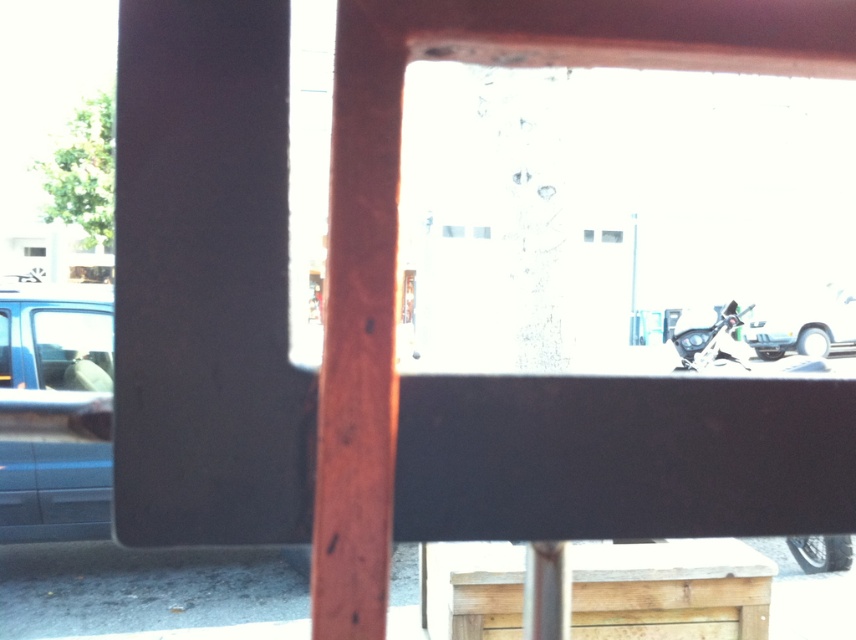
You are a delivery person needing to park your vehicle. You see a matte blue van at left and a shiny metallic motorcycle at lower right. Which vehicle is parked closer to the window frame?

The matte blue van at left is closer to the viewer than the shiny metallic motorcycle at lower right, so the matte blue van at left is parked closer to the window frame.

You are standing in front of a window with a wooden frame. You notice two points marked on the window glass at coordinates point (776, 305) and point (720, 340). Which point is closer to your face?

Point (720, 340) is closer to your face because it is less further to the camera than point (776, 305).

Looking at this image, you are a delivery person trying to navigate through the street. You see the shiny silver car at right and the shiny metallic motorcycle at lower right. Which vehicle is closer to you?

The shiny metallic motorcycle at lower right is closer to you because the shiny silver car at right is further away.